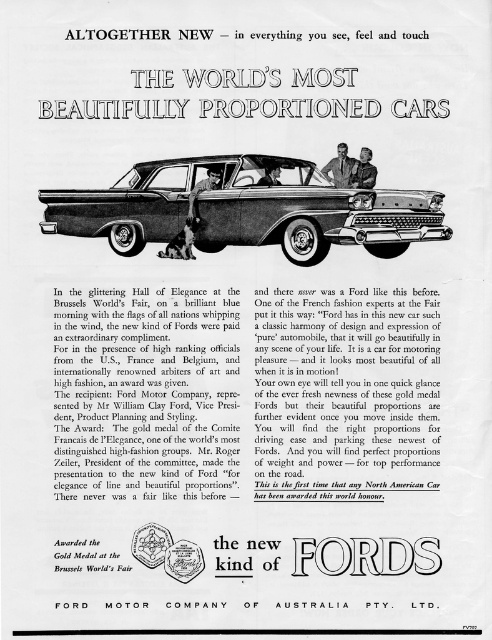
You are a customer at a car dealership looking at the shiny dark brown car at center and the dark suit jacket at center displayed in the vintage Ford advertisement. Which object is positioned closer to you?

The shiny dark brown car at center is closer to the viewer than the dark suit jacket at center.